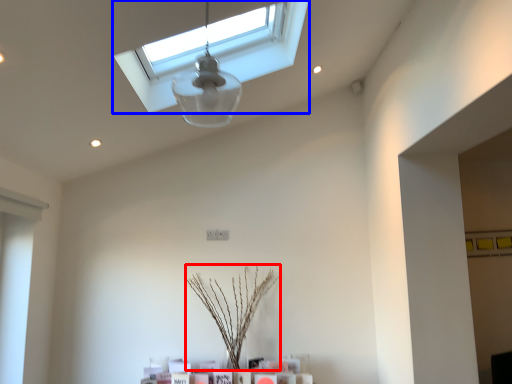
Question: Which object appears closest to the camera in this image, plant (highlighted by a red box) or window (highlighted by a blue box)?

Choices:
 (A) plant
 (B) window

Answer: (B)